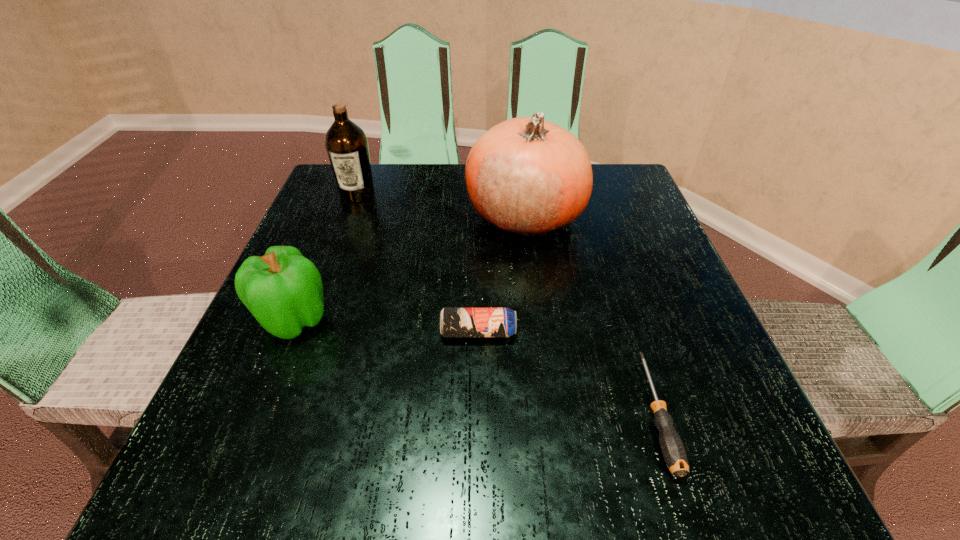
Identify the location of vacant position located 0.250m on the left of the rightmost object. (469, 413).

The image size is (960, 540). I want to click on pumpkin that is at the far edge, so click(x=527, y=176).

Image resolution: width=960 pixels, height=540 pixels. What are the coordinates of `olive oil positioned at the far edge` in the screenshot? It's located at tap(346, 143).

Identify the location of object that is at the near edge. The height and width of the screenshot is (540, 960). pyautogui.click(x=672, y=448).

I want to click on olive oil located in the left edge section of the desktop, so click(346, 143).

The image size is (960, 540). Identify the location of bell pepper located at the left edge. (283, 290).

Find the location of a particular element. pumpkin that is at the right edge is located at coordinates (527, 176).

Where is `screwdriver that is at the right edge`? screwdriver that is at the right edge is located at coordinates tap(672, 448).

The width and height of the screenshot is (960, 540). In order to click on object at the far left corner in this screenshot , I will do `click(346, 143)`.

Where is `object present at the far right corner`? The width and height of the screenshot is (960, 540). object present at the far right corner is located at coordinates (527, 176).